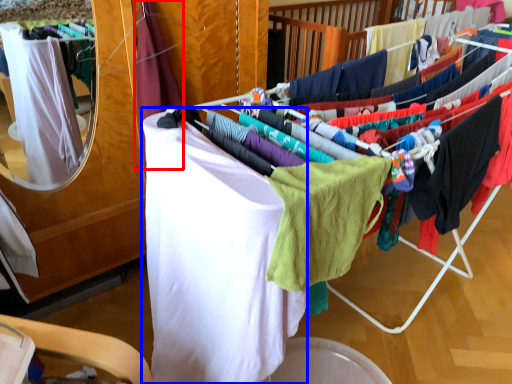
Question: Which point is closer to the camera, clothing (highlighted by a red box) or clothing (highlighted by a blue box)?

Choices:
 (A) clothing
 (B) clothing

Answer: (B)